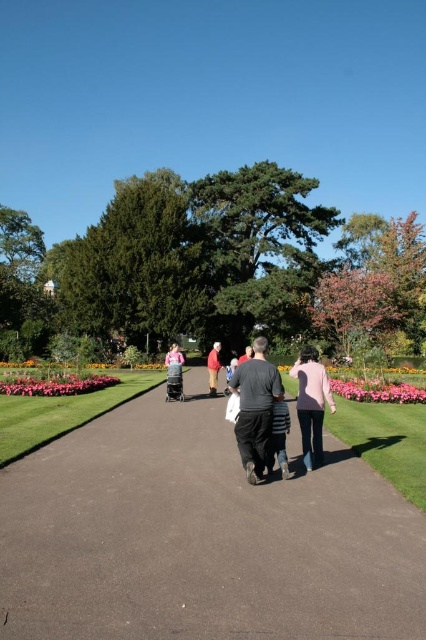
Which is in front, point (316, 429) or point (282, 435)?

Point (282, 435) is in front.

Does pink matte jacket at center have a larger size compared to dark gray fabric jacket at center?

Yes.

Which is in front, point (302, 356) or point (273, 440)?

Point (273, 440)

What are the coordinates of `pink matte jacket at center` in the screenshot? It's located at (311, 403).

What do you see at coordinates (255, 408) in the screenshot?
I see `dark gray fabric pants at center` at bounding box center [255, 408].

Is point (253, 461) in front of point (271, 429)?

Yes, point (253, 461) is closer to viewer.

This screenshot has height=640, width=426. I want to click on dark gray fabric pants at center, so click(x=255, y=408).

Image resolution: width=426 pixels, height=640 pixels. In order to click on pink floral bed at center in this screenshot , I will do `click(54, 384)`.

This screenshot has height=640, width=426. What do you see at coordinates (54, 384) in the screenshot?
I see `pink floral bed at center` at bounding box center [54, 384].

Identify the location of pink floral bed at center. (54, 384).